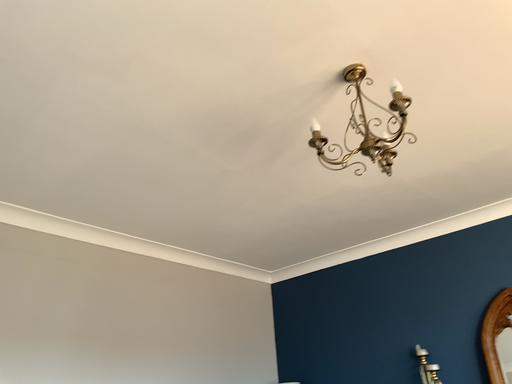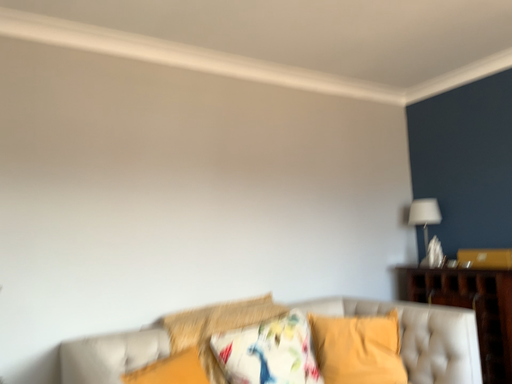
Question: Which way did the camera rotate in the video?

Choices:
 (A) rotated downward
 (B) rotated upward

Answer: (A)